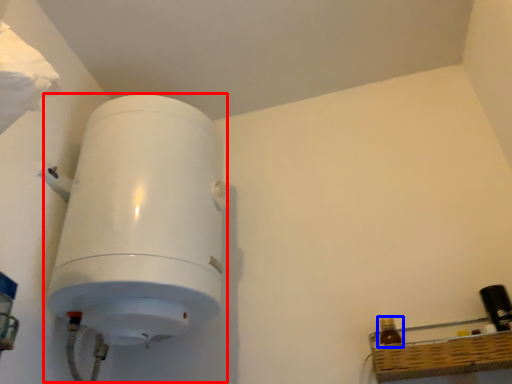
Question: Among these objects, which one is farthest to the camera, appliance (highlighted by a red box) or bottle (highlighted by a blue box)?

Choices:
 (A) appliance
 (B) bottle

Answer: (B)